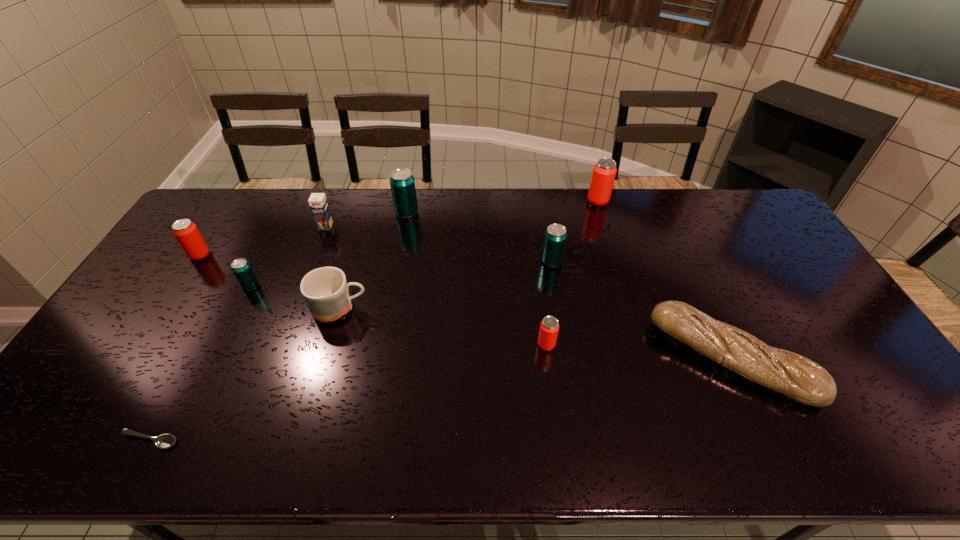
The width and height of the screenshot is (960, 540). What are the coordinates of `object that is at the near edge` in the screenshot? It's located at (164, 441).

You are a GUI agent. You are given a task and a screenshot of the screen. Output one action in this format:
    pyautogui.click(x=<x>, y=<y>)
    Task: Click on the object present at the left edge
    This screenshot has width=960, height=540.
    Given the screenshot: What is the action you would take?
    pyautogui.click(x=185, y=231)

The width and height of the screenshot is (960, 540). In the image, there is a desktop. In order to click on vacant space at the far edge in this screenshot , I will do `click(359, 217)`.

Where is `vacant space at the near edge of the desktop`? This screenshot has width=960, height=540. vacant space at the near edge of the desktop is located at coordinates (254, 453).

Where is `vacant space at the left edge of the desktop`? vacant space at the left edge of the desktop is located at coordinates (112, 387).

Locate an element on the screen. free space at the right edge of the desktop is located at coordinates (780, 271).

In the image, there is a desktop. Where is `vacant space at the far right corner`? The height and width of the screenshot is (540, 960). vacant space at the far right corner is located at coordinates (728, 192).

I want to click on vacant area at the near right corner, so click(x=894, y=430).

Where is `empty space between the baguet and the soupspoon`? The image size is (960, 540). empty space between the baguet and the soupspoon is located at coordinates (441, 400).

Image resolution: width=960 pixels, height=540 pixels. Identify the location of free point between the rightmost beer can and the smallest red beer can. (572, 273).